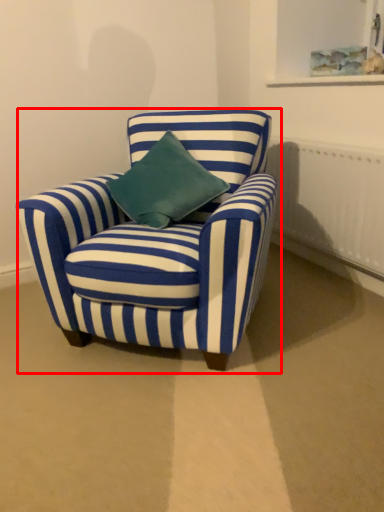
Question: From the image's perspective, what is the correct spatial positioning of chair (annotated by the red box) in reference to radiator?

Choices:
 (A) below
 (B) above

Answer: (A)